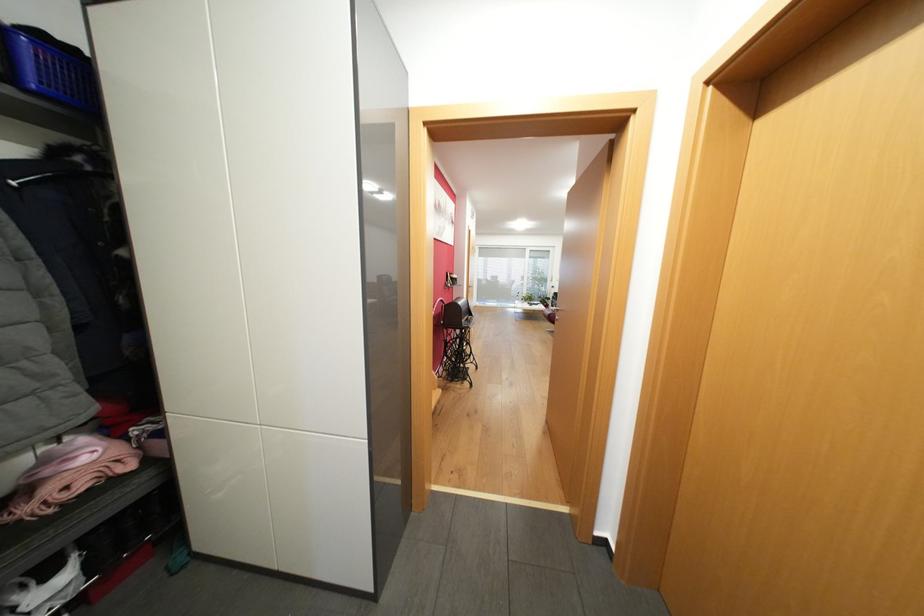
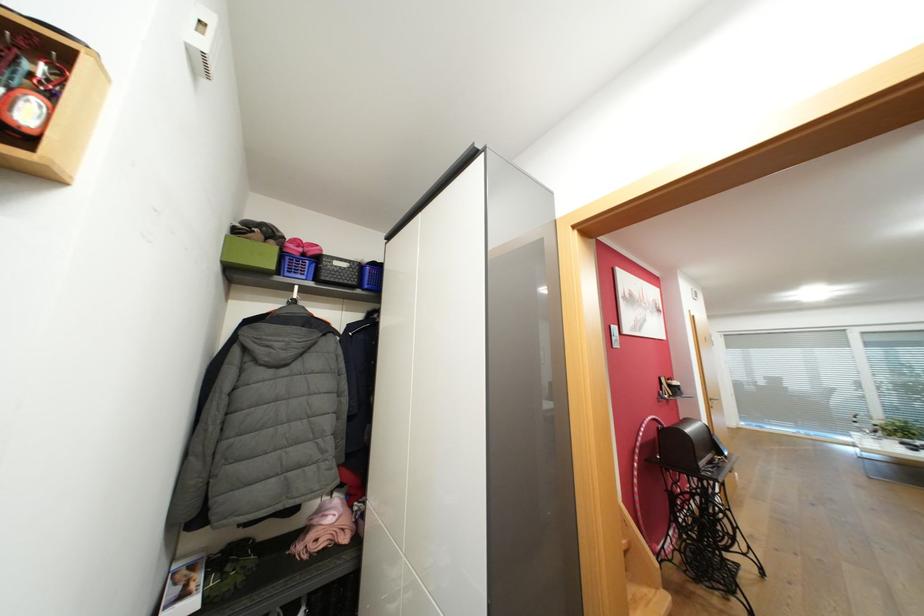
Locate, in the second image, the point that corresponds to point (467, 302) in the first image.

(696, 430)